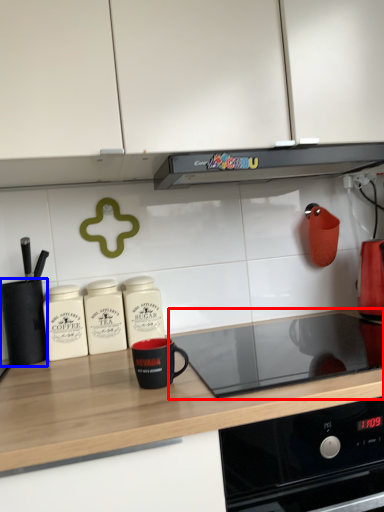
Question: Which object appears closest to the camera in this image, gas stove (highlighted by a red box) or kitchen appliance (highlighted by a blue box)?

Choices:
 (A) gas stove
 (B) kitchen appliance

Answer: (A)